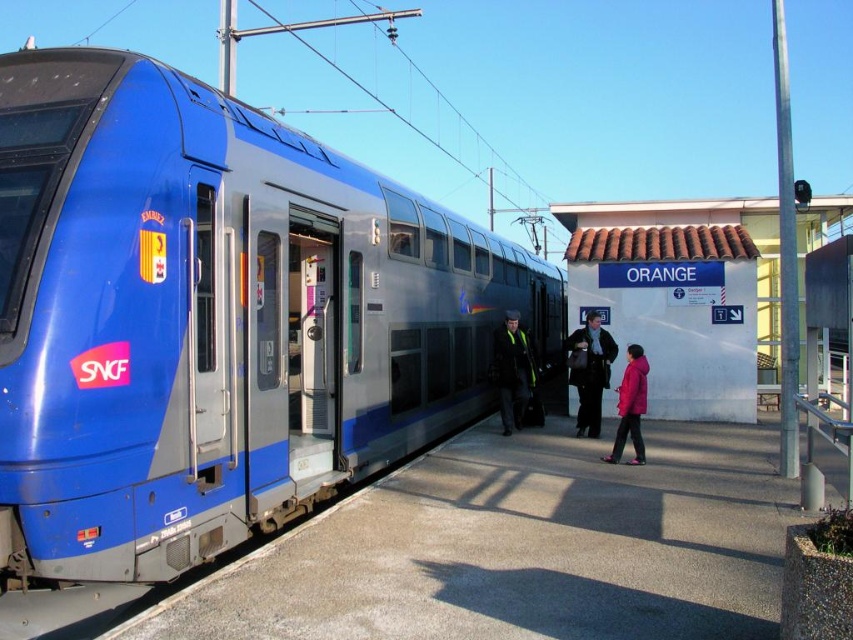
Question: Where is matte blue train at left located in relation to reflective yellow vest at center in the image?

Choices:
 (A) above
 (B) below

Answer: (A)

Question: Considering the relative positions of matte blue train at left and reflective yellow vest at center in the image provided, where is matte blue train at left located with respect to reflective yellow vest at center?

Choices:
 (A) below
 (B) above

Answer: (B)

Question: Considering the real-world distances, which object is closest to the reflective yellow vest at center?

Choices:
 (A) pink matte jacket at center
 (B) dark blue fabric coat at center

Answer: (B)

Question: Does dark blue fabric coat at center have a lesser width compared to pink matte jacket at center?

Choices:
 (A) yes
 (B) no

Answer: (B)

Question: Which point is farther to the camera?

Choices:
 (A) matte blue train at left
 (B) dark blue fabric coat at center
 (C) reflective yellow vest at center

Answer: (C)

Question: Estimate the real-world distances between objects in this image. Which object is closer to the dark blue fabric coat at center?

Choices:
 (A) pink matte jacket at center
 (B) matte blue train at left
 (C) reflective yellow vest at center

Answer: (C)